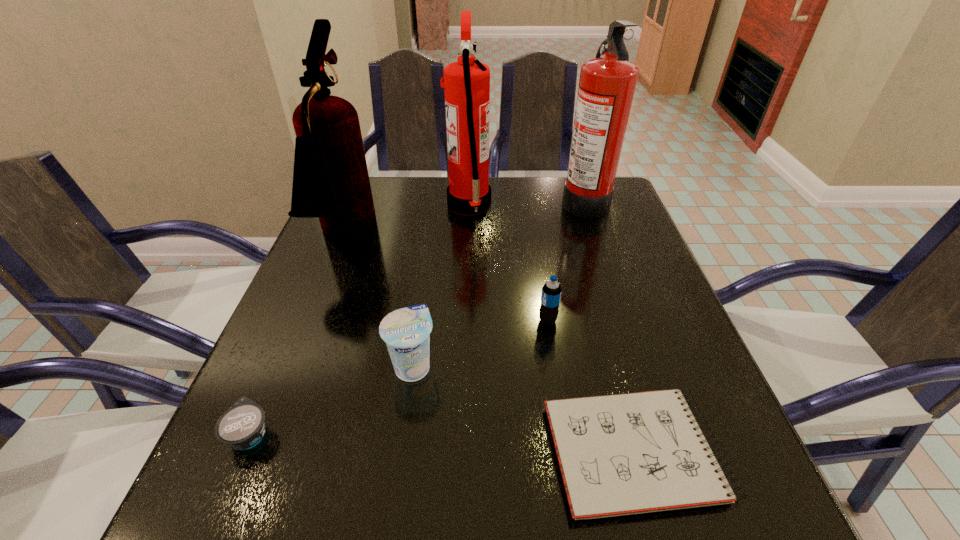
Where is `yogurt positioned at the left edge`? The width and height of the screenshot is (960, 540). yogurt positioned at the left edge is located at coordinates (242, 426).

This screenshot has width=960, height=540. I want to click on fire extinguisher that is at the right edge, so click(x=606, y=88).

The width and height of the screenshot is (960, 540). In order to click on notepad positioned at the right edge in this screenshot , I will do `click(621, 454)`.

At what (x,y) coordinates should I click in order to perform the action: click on object positioned at the far left corner. Please return your answer as a coordinate pair (x, y). This screenshot has width=960, height=540. Looking at the image, I should click on (330, 178).

Identify the location of object located at the far right corner. This screenshot has width=960, height=540. (606, 88).

Identify the location of object situated at the near right corner. The width and height of the screenshot is (960, 540). (621, 454).

Locate an element on the screen. free spot at the far edge of the desktop is located at coordinates pyautogui.click(x=526, y=208).

This screenshot has height=540, width=960. In order to click on free point at the near edge in this screenshot , I will do `click(372, 504)`.

Find the location of a particular element. This screenshot has width=960, height=540. free space at the left edge of the desktop is located at coordinates (316, 323).

Where is `vacant area at the right edge of the desktop`? This screenshot has height=540, width=960. vacant area at the right edge of the desktop is located at coordinates (642, 276).